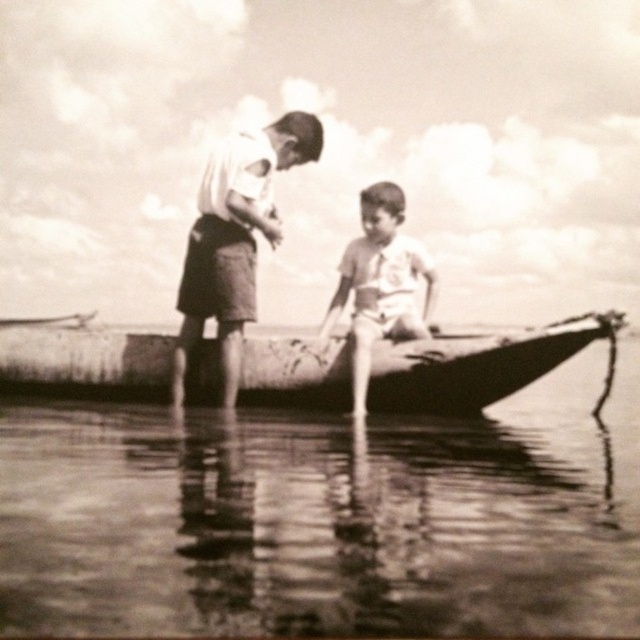
Question: Is smooth cotton shirt at center positioned in front of striped cotton shirt at center?

Choices:
 (A) no
 (B) yes

Answer: (A)

Question: Is smooth wood canoe at center further to camera compared to smooth cotton shirt at center?

Choices:
 (A) yes
 (B) no

Answer: (B)

Question: Which point appears farthest from the camera in this image?

Choices:
 (A) (360, 204)
 (B) (56, 442)

Answer: (A)

Question: Which object is farther from the camera taking this photo?

Choices:
 (A) smooth wood canoe at center
 (B) smooth water at boat bottom
 (C) striped cotton shirt at center
 (D) smooth cotton shirt at center

Answer: (D)

Question: Considering the relative positions of smooth water at boat bottom and striped cotton shirt at center in the image provided, where is smooth water at boat bottom located with respect to striped cotton shirt at center?

Choices:
 (A) left
 (B) right

Answer: (A)

Question: Based on their relative distances, which object is farther from the smooth cotton shirt at center?

Choices:
 (A) smooth water at boat bottom
 (B) smooth wood canoe at center

Answer: (B)